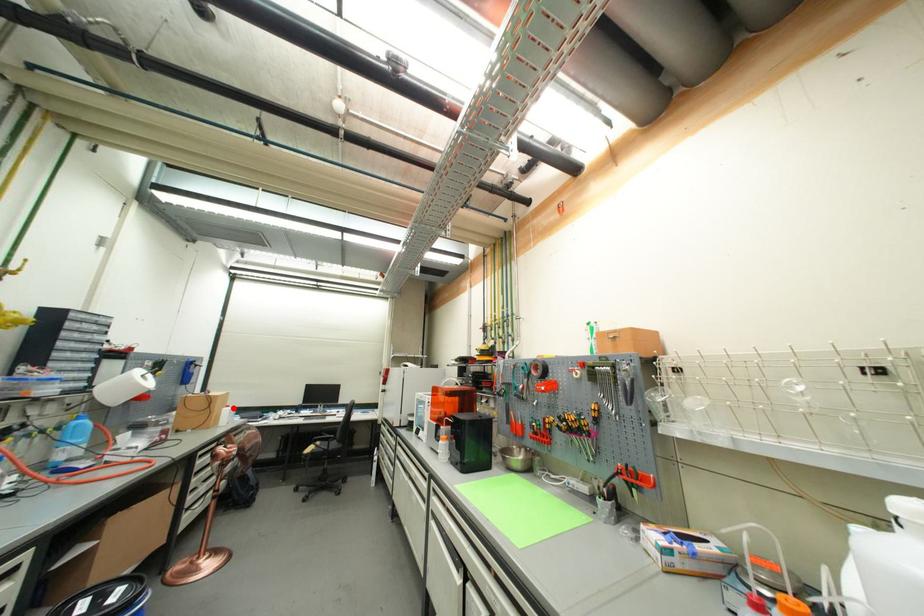
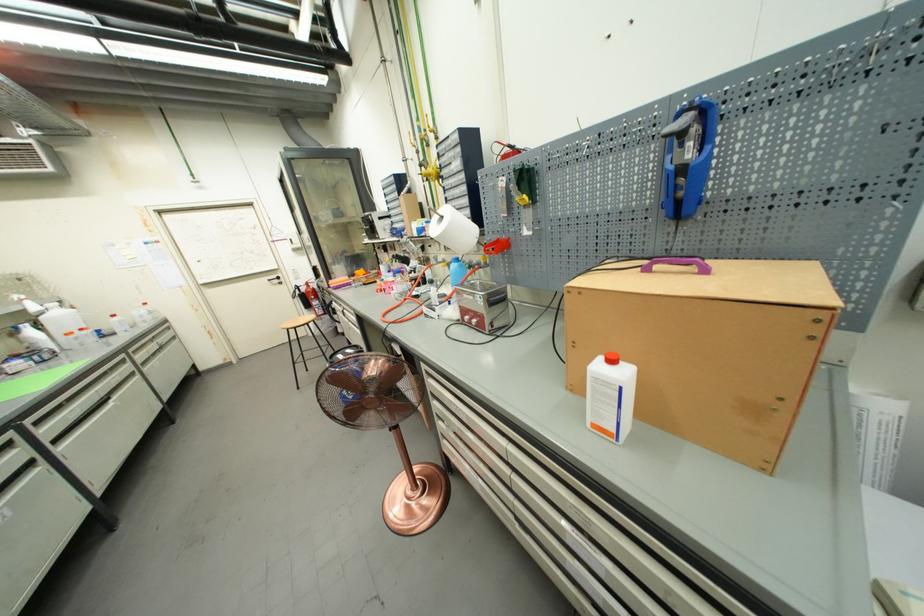
Question: I am providing you with two images of the same scene from different viewpoints. A red point is shown in image1. For the corresponding object point in image2, is it positioned nearer or farther from the camera?

Choices:
 (A) Nearer
 (B) Farther

Answer: (B)